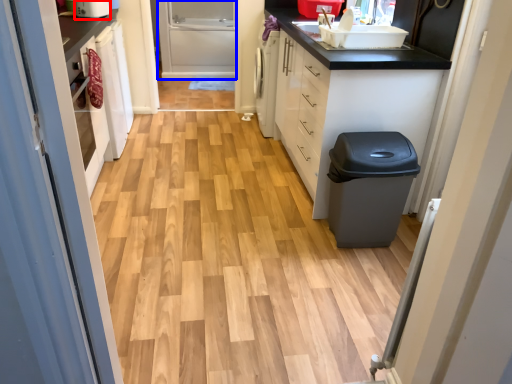
Question: Which point is closer to the camera, appliance (highlighted by a red box) or screen door (highlighted by a blue box)?

Choices:
 (A) appliance
 (B) screen door

Answer: (A)